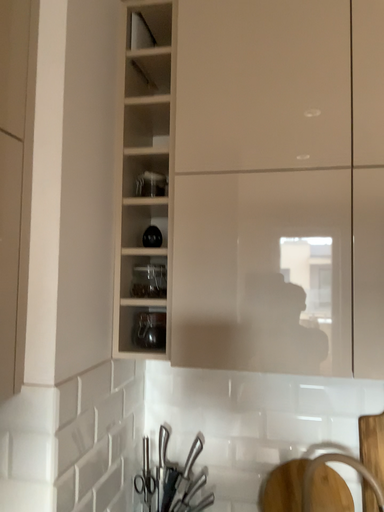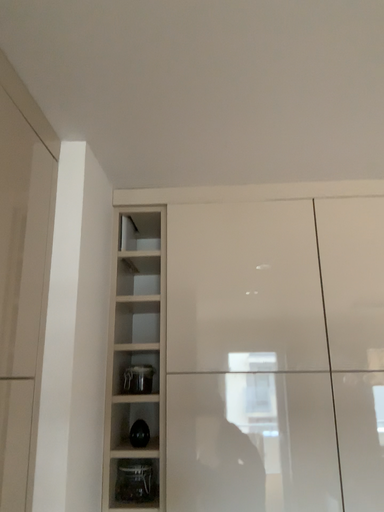
Question: Which way did the camera rotate in the video?

Choices:
 (A) rotated upward
 (B) rotated downward

Answer: (A)